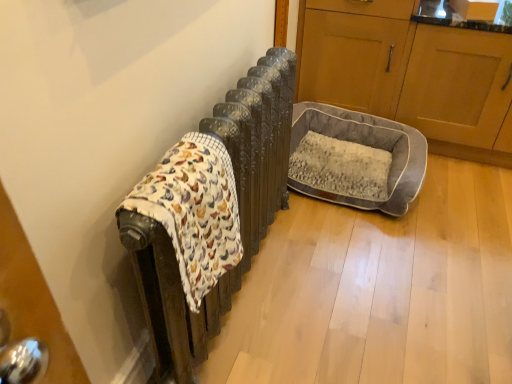
What do you see at coordinates (370, 145) in the screenshot? The height and width of the screenshot is (384, 512). I see `gray plush dog bed at center` at bounding box center [370, 145].

Measure the distance between gray plush dog bed at center and camera.

gray plush dog bed at center and camera are 6.07 feet apart.

This screenshot has width=512, height=384. I want to click on fluffy cotton blanket at left, so click(194, 211).

What do you see at coordinates (354, 57) in the screenshot? This screenshot has width=512, height=384. I see `gray fabric pet bed at right, which is the 1th screen door in back-to-front order` at bounding box center [354, 57].

The image size is (512, 384). In order to click on gray plush dog bed at center in this screenshot , I will do `click(370, 145)`.

Find the location of a particular element. This screenshot has width=512, height=384. dog bed behind the fluffy cotton blanket at left is located at coordinates (370, 145).

From the image's perspective, is fluffy cotton blanket at left beneath gray plush dog bed at center?

Yes.

Which object is further away from the camera taking this photo, fluffy cotton blanket at left or gray plush dog bed at center?

Positioned behind is gray plush dog bed at center.

Which is more to the left, fluffy cotton blanket at left or gray plush dog bed at center?

Positioned to the left is fluffy cotton blanket at left.

Does fluffy cotton blanket at left have a larger size compared to gray fabric pet bed at right, acting as the second screen door starting from the front?

Actually, fluffy cotton blanket at left might be smaller than gray fabric pet bed at right, acting as the second screen door starting from the front.

From a real-world perspective, which object rests below the other?

gray fabric pet bed at right, which is the 1th screen door in back-to-front order.

From the image's perspective, which is below, fluffy cotton blanket at left or gray fabric pet bed at right, acting as the second screen door starting from the front?

fluffy cotton blanket at left is shown below in the image.

Is fluffy cotton blanket at left taller or shorter than gray fabric pet bed at right, acting as the second screen door starting from the front?

Clearly, fluffy cotton blanket at left is shorter compared to gray fabric pet bed at right, acting as the second screen door starting from the front.

Between gray fabric pet bed at right, which is the 1th screen door in back-to-front order, and gray plush dog bed at center, which one has larger size?

Bigger between the two is gray fabric pet bed at right, which is the 1th screen door in back-to-front order.

Is gray plush dog bed at center inside gray fabric pet bed at right, acting as the second screen door starting from the front?

No, gray plush dog bed at center is not surrounded by gray fabric pet bed at right, acting as the second screen door starting from the front.

Is gray fabric pet bed at right, acting as the second screen door starting from the front, wider or thinner than gray plush dog bed at center?

Clearly, gray fabric pet bed at right, acting as the second screen door starting from the front, has less width compared to gray plush dog bed at center.

Is gray plush dog bed at center at the back of gray fabric pet bed at right, which is the 1th screen door in back-to-front order?

gray fabric pet bed at right, which is the 1th screen door in back-to-front order, does not have its back to gray plush dog bed at center.

Visually, is gray fabric pet bed at right, acting as the second screen door starting from the front, positioned to the left or to the right of wooden cabinet at right, which appears as the 1th screen door when viewed from the front?

gray fabric pet bed at right, acting as the second screen door starting from the front, is positioned on wooden cabinet at right, which appears as the 1th screen door when viewed from the front,'s left side.

Is gray fabric pet bed at right, which is the 1th screen door in back-to-front order, further to the viewer compared to wooden cabinet at right, acting as the second screen door starting from the back?

Yes, it is.

Are gray fabric pet bed at right, acting as the second screen door starting from the front, and wooden cabinet at right, which appears as the 1th screen door when viewed from the front, located far from each other?

No, gray fabric pet bed at right, acting as the second screen door starting from the front, is in close proximity to wooden cabinet at right, which appears as the 1th screen door when viewed from the front.

Is wooden cabinet at right, acting as the second screen door starting from the back, inside gray fabric pet bed at right, acting as the second screen door starting from the front?

Actually, wooden cabinet at right, acting as the second screen door starting from the back, is outside gray fabric pet bed at right, acting as the second screen door starting from the front.

From the image's perspective, is gray plush dog bed at center on wooden cabinet at right, acting as the second screen door starting from the back?

Actually, gray plush dog bed at center appears below wooden cabinet at right, acting as the second screen door starting from the back, in the image.

Which object is closer to the camera, gray plush dog bed at center or wooden cabinet at right, acting as the second screen door starting from the back?

wooden cabinet at right, acting as the second screen door starting from the back.

Considering the sizes of objects gray plush dog bed at center and wooden cabinet at right, which appears as the 1th screen door when viewed from the front, in the image provided, who is wider, gray plush dog bed at center or wooden cabinet at right, which appears as the 1th screen door when viewed from the front,?

wooden cabinet at right, which appears as the 1th screen door when viewed from the front, is wider.

At what (x,y) coordinates should I click in order to perform the action: click on screen door in front of the gray plush dog bed at center. Please return your answer as a coordinate pair (x, y). Looking at the image, I should click on (457, 85).

Could you tell me if gray plush dog bed at center is facing gray fabric pet bed at right, acting as the second screen door starting from the front?

Yes, gray plush dog bed at center faces towards gray fabric pet bed at right, acting as the second screen door starting from the front.

From a real-world perspective, is gray plush dog bed at center below gray fabric pet bed at right, which is the 1th screen door in back-to-front order?

Correct, in the physical world, gray plush dog bed at center is lower than gray fabric pet bed at right, which is the 1th screen door in back-to-front order.

Who is bigger, gray plush dog bed at center or gray fabric pet bed at right, acting as the second screen door starting from the front?

With larger size is gray fabric pet bed at right, acting as the second screen door starting from the front.

In the image, is gray fabric pet bed at right, which is the 1th screen door in back-to-front order, positioned in front of or behind fluffy cotton blanket at left?

Clearly, gray fabric pet bed at right, which is the 1th screen door in back-to-front order, is behind fluffy cotton blanket at left.

Can you confirm if gray fabric pet bed at right, acting as the second screen door starting from the front, is taller than fluffy cotton blanket at left?

Indeed, gray fabric pet bed at right, acting as the second screen door starting from the front, has a greater height compared to fluffy cotton blanket at left.

Would you say gray fabric pet bed at right, which is the 1th screen door in back-to-front order, is outside fluffy cotton blanket at left?

Yes, gray fabric pet bed at right, which is the 1th screen door in back-to-front order, is located beyond the bounds of fluffy cotton blanket at left.

I want to click on dog bed that is above the fluffy cotton blanket at left (from the image's perspective), so click(370, 145).

Which screen door is the 1st one when counting from the right side of the fluffy cotton blanket at left? Please provide its 2D coordinates.

[(354, 57)]

When comparing their distances from wooden cabinet at right, which appears as the 1th screen door when viewed from the front, does fluffy cotton blanket at left or gray plush dog bed at center seem further?

fluffy cotton blanket at left.

Looking at the image, which one is located further to gray fabric pet bed at right, acting as the second screen door starting from the front, wooden cabinet at right, acting as the second screen door starting from the back, or fluffy cotton blanket at left?

Among the two, fluffy cotton blanket at left is located further to gray fabric pet bed at right, acting as the second screen door starting from the front.

Which object lies further to the anchor point gray fabric pet bed at right, acting as the second screen door starting from the front, wooden cabinet at right, acting as the second screen door starting from the back, or gray plush dog bed at center?

Among the two, gray plush dog bed at center is located further to gray fabric pet bed at right, acting as the second screen door starting from the front.

Which object lies nearer to the anchor point gray fabric pet bed at right, acting as the second screen door starting from the front, gray plush dog bed at center or wooden cabinet at right, acting as the second screen door starting from the back?

The object closer to gray fabric pet bed at right, acting as the second screen door starting from the front, is wooden cabinet at right, acting as the second screen door starting from the back.

From the image, which object appears to be farther from gray plush dog bed at center, wooden cabinet at right, which appears as the 1th screen door when viewed from the front, or fluffy cotton blanket at left?

fluffy cotton blanket at left is positioned further to the anchor gray plush dog bed at center.

Looking at the image, which one is located closer to gray fabric pet bed at right, which is the 1th screen door in back-to-front order, fluffy cotton blanket at left or wooden cabinet at right, acting as the second screen door starting from the back?

wooden cabinet at right, acting as the second screen door starting from the back.

Looking at the image, which one is located further to gray plush dog bed at center, fluffy cotton blanket at left or wooden cabinet at right, acting as the second screen door starting from the back?

Among the two, fluffy cotton blanket at left is located further to gray plush dog bed at center.

Looking at the image, which one is located closer to fluffy cotton blanket at left, gray fabric pet bed at right, which is the 1th screen door in back-to-front order, or gray plush dog bed at center?

gray plush dog bed at center is closer to fluffy cotton blanket at left.

The width and height of the screenshot is (512, 384). I want to click on dog bed between gray fabric pet bed at right, acting as the second screen door starting from the front, and fluffy cotton blanket at left from top to bottom, so click(370, 145).

Locate an element on the screen. This screenshot has height=384, width=512. screen door between fluffy cotton blanket at left and wooden cabinet at right, acting as the second screen door starting from the back, in the horizontal direction is located at coordinates (354, 57).

The width and height of the screenshot is (512, 384). I want to click on screen door that lies between gray fabric pet bed at right, acting as the second screen door starting from the front, and gray plush dog bed at center from top to bottom, so click(457, 85).

Image resolution: width=512 pixels, height=384 pixels. I want to click on dog bed between fluffy cotton blanket at left and wooden cabinet at right, acting as the second screen door starting from the back, from left to right, so pyautogui.click(x=370, y=145).